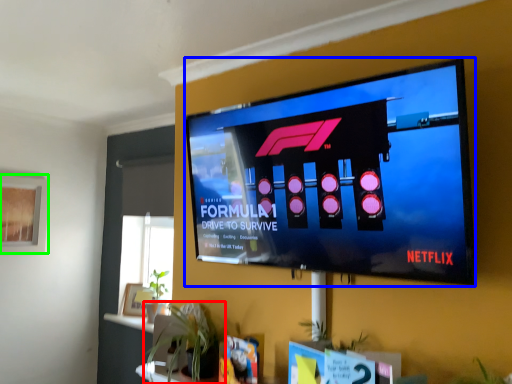
Question: Estimate the real-world distances between objects in this image. Which object is closer to houseplant (highlighted by a red box), television (highlighted by a blue box) or window screen (highlighted by a green box)?

Choices:
 (A) television
 (B) window screen

Answer: (A)